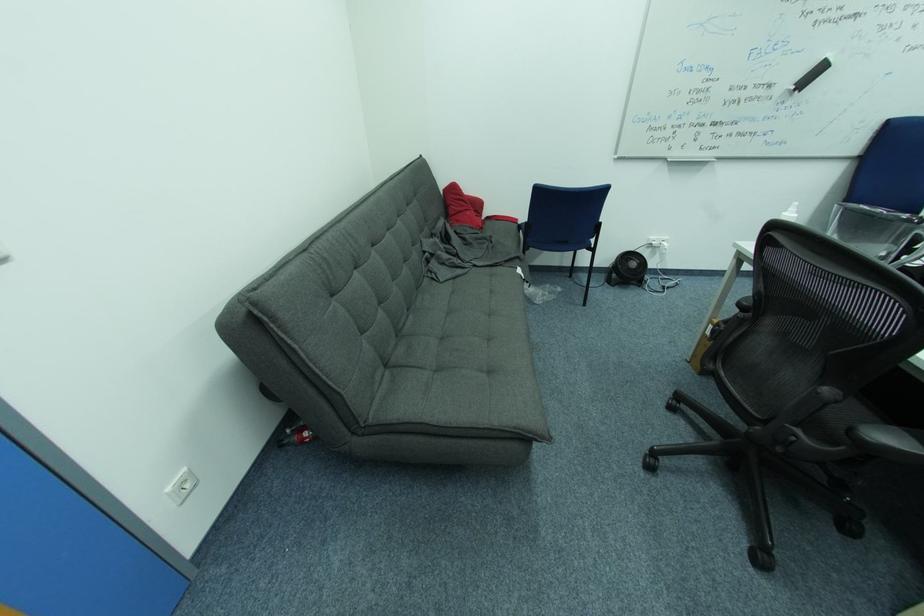
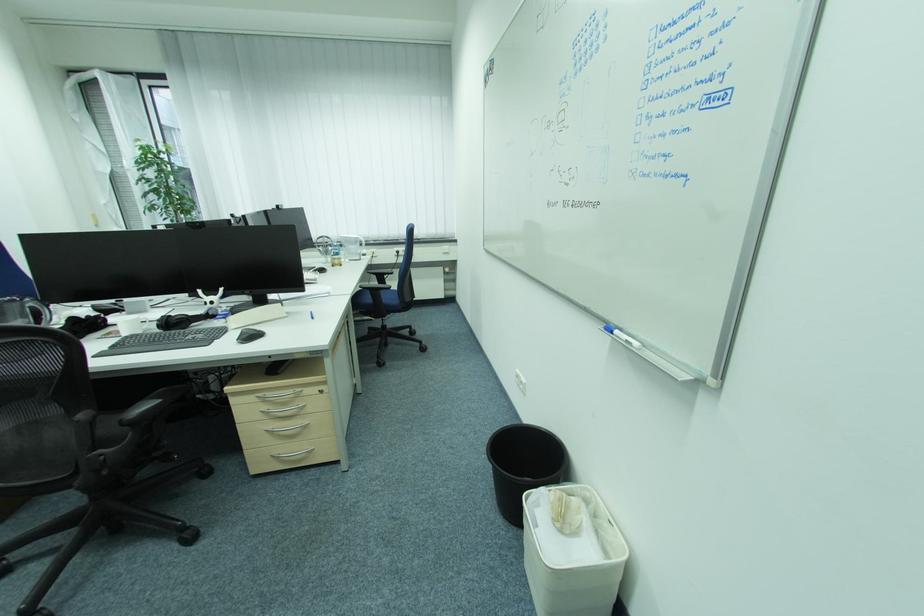
How did the camera likely rotate?

The camera's rotation is toward right-down.